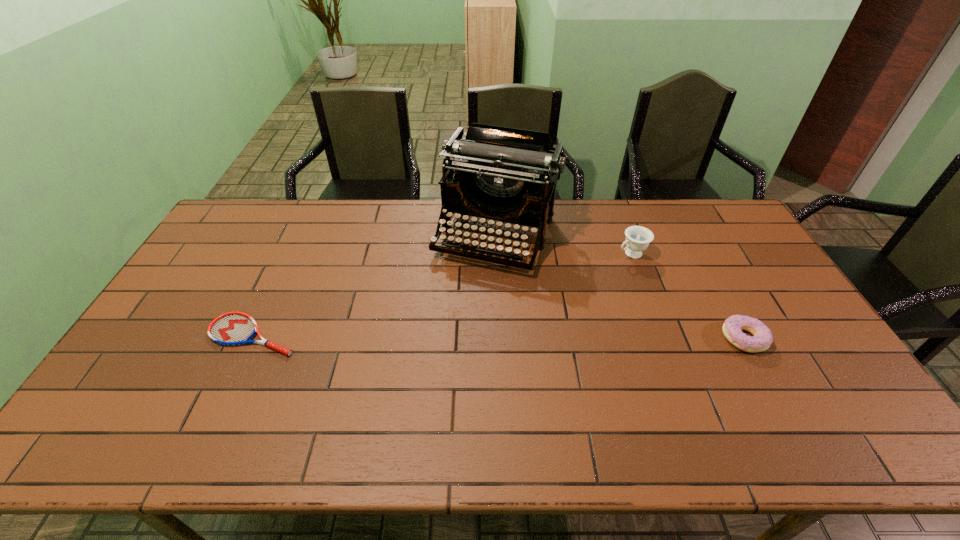
The image size is (960, 540). In order to click on vacant spot on the desktop that is between the leftmost object and the doughnut and is positioned on the typing side of the third object from right to left in this screenshot , I will do `click(453, 336)`.

Locate an element on the screen. Image resolution: width=960 pixels, height=540 pixels. free space on the desktop that is between the shortest object and the third tallest object and is positioned on the side of the second tallest object with the handle is located at coordinates (459, 336).